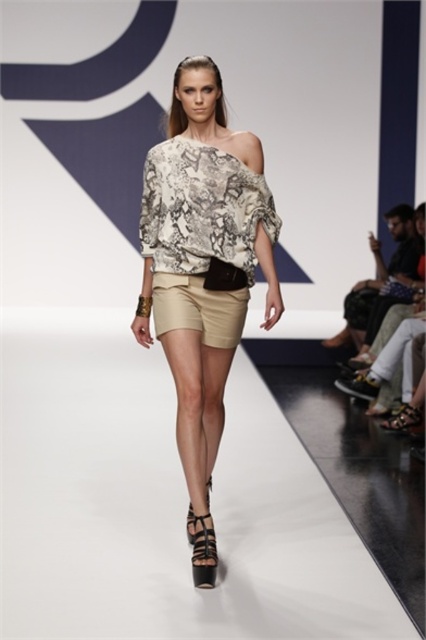
Is snake print fabric top at center smaller than black leather sandal at center?

Incorrect, snake print fabric top at center is not smaller in size than black leather sandal at center.

Is point (241, 163) less distant than point (187, 516)?

Yes, it is.

Is point (226, 307) behind point (189, 506)?

No.

Find the location of `snake print fabric top at center`. snake print fabric top at center is located at coordinates (203, 257).

Between snake print fabric top at center and leather/textured sandal at lower center, which one is positioned higher?

snake print fabric top at center is above.

Is snake print fabric top at center to the left of leather/textured sandal at lower center from the viewer's perspective?

In fact, snake print fabric top at center is to the right of leather/textured sandal at lower center.

What do you see at coordinates (203, 257) in the screenshot? This screenshot has width=426, height=640. I see `snake print fabric top at center` at bounding box center [203, 257].

Identify the location of snake print fabric top at center. This screenshot has width=426, height=640. (203, 257).

Between beige cotton shorts at center and leather textured sandal at lower right, which one has more height?

With more height is beige cotton shorts at center.

Can you confirm if beige cotton shorts at center is smaller than leather textured sandal at lower right?

Incorrect, beige cotton shorts at center is not smaller in size than leather textured sandal at lower right.

Which is behind, point (167, 314) or point (405, 403)?

The point (405, 403) is more distant.

The width and height of the screenshot is (426, 640). What are the coordinates of `beige cotton shorts at center` in the screenshot? It's located at (198, 308).